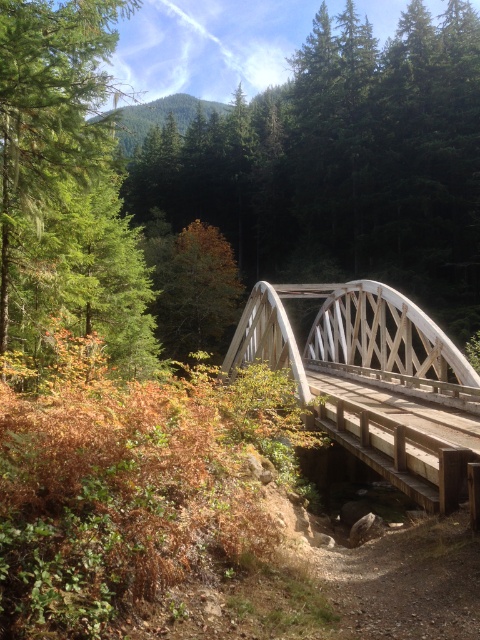
This screenshot has height=640, width=480. I want to click on green matte tree at upper left, so click(66, 186).

Between green matte tree at upper left and orange matte tree at center, which one is positioned lower?

green matte tree at upper left

Identify the location of green matte tree at upper left. (66, 186).

Does white wooden bridge at center appear on the left side of orange matte tree at center?

Incorrect, white wooden bridge at center is not on the left side of orange matte tree at center.

Is white wooden bridge at center below orange matte tree at center?

Yes.

This screenshot has height=640, width=480. What are the coordinates of `white wooden bridge at center` in the screenshot? It's located at (372, 380).

Describe the element at coordinates (66, 186) in the screenshot. I see `green matte tree at upper left` at that location.

Which is above, green matte tree at upper left or white wooden bridge at center?

green matte tree at upper left is higher up.

Who is more distant from viewer, (46, 321) or (319, 292)?

The point (319, 292) is more distant.

I want to click on green matte tree at upper left, so click(66, 186).